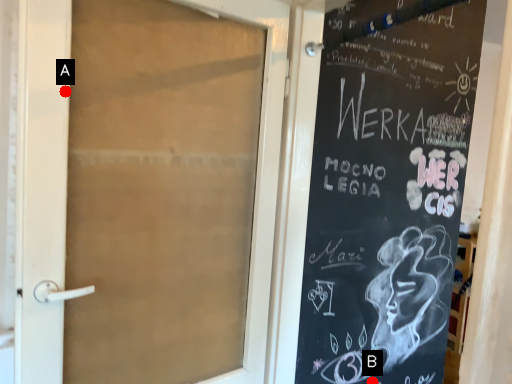
Question: Two points are circled on the image, labeled by A and B beside each circle. Among these points, which one is farthest from the camera?

Choices:
 (A) A is further
 (B) B is further

Answer: (B)